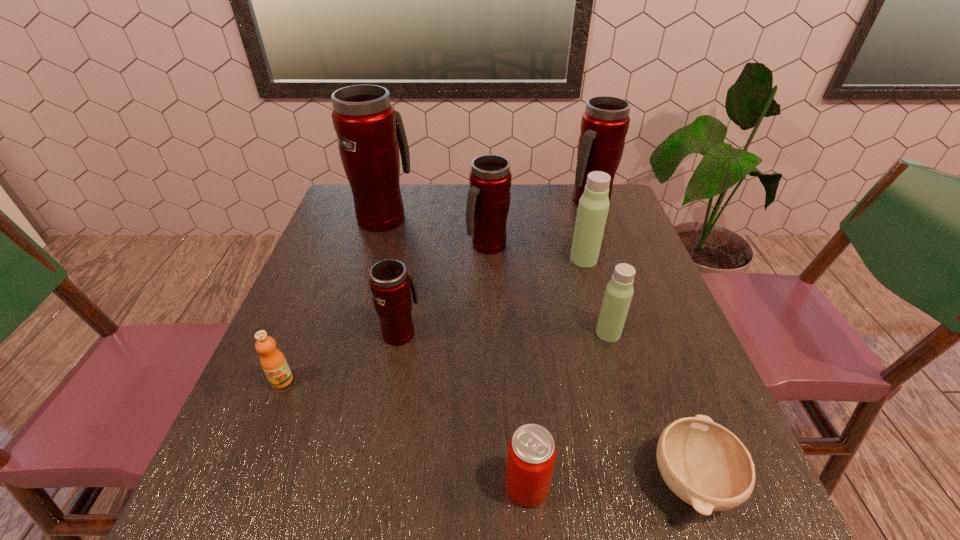
Locate an element on the screen. The height and width of the screenshot is (540, 960). free space located on the side with the handle of the smallest red thermos bottle is located at coordinates (413, 266).

I want to click on vacant space located on the side with the handle of the smallest red thermos bottle, so click(410, 279).

Identify the location of free spot located on the left of the nearer light thermos bottle. (457, 333).

Where is `free location located 0.080m on the front label of the leftmost object`? The height and width of the screenshot is (540, 960). free location located 0.080m on the front label of the leftmost object is located at coordinates (263, 427).

Locate an element on the screen. vacant area situated on the right of the red can is located at coordinates (648, 486).

At what (x,y) coordinates should I click in order to perform the action: click on free region located on the left of the bowl. Please return your answer as a coordinate pair (x, y). The image size is (960, 540). Looking at the image, I should click on (458, 480).

At what (x,y) coordinates should I click in order to perform the action: click on can that is positioned at the near edge. Please return your answer as a coordinate pair (x, y). This screenshot has width=960, height=540. Looking at the image, I should click on (531, 457).

In order to click on bowl located at the near edge in this screenshot , I will do `click(703, 463)`.

The width and height of the screenshot is (960, 540). What are the coordinates of `thermos bottle present at the left edge` in the screenshot? It's located at (370, 133).

Find the location of a particular element. orange juice that is positioned at the left edge is located at coordinates (273, 362).